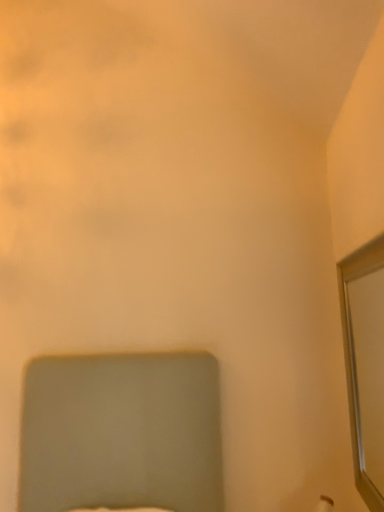
Question: From the image's perspective, relative to matte gray bed at lower center, is white textured mirror at right above or below?

Choices:
 (A) below
 (B) above

Answer: (B)

Question: Is white textured mirror at right wider or thinner than matte gray bed at lower center?

Choices:
 (A) wide
 (B) thin

Answer: (B)

Question: Would you say white textured mirror at right is inside or outside matte gray bed at lower center?

Choices:
 (A) inside
 (B) outside

Answer: (B)

Question: Is matte gray bed at lower center in front of or behind white textured mirror at right in the image?

Choices:
 (A) behind
 (B) front

Answer: (B)

Question: From the image's perspective, is matte gray bed at lower center located above or below white textured mirror at right?

Choices:
 (A) below
 (B) above

Answer: (A)

Question: Visually, is matte gray bed at lower center positioned to the left or to the right of white textured mirror at right?

Choices:
 (A) right
 (B) left

Answer: (B)

Question: From a real-world perspective, is matte gray bed at lower center positioned above or below white textured mirror at right?

Choices:
 (A) below
 (B) above

Answer: (A)